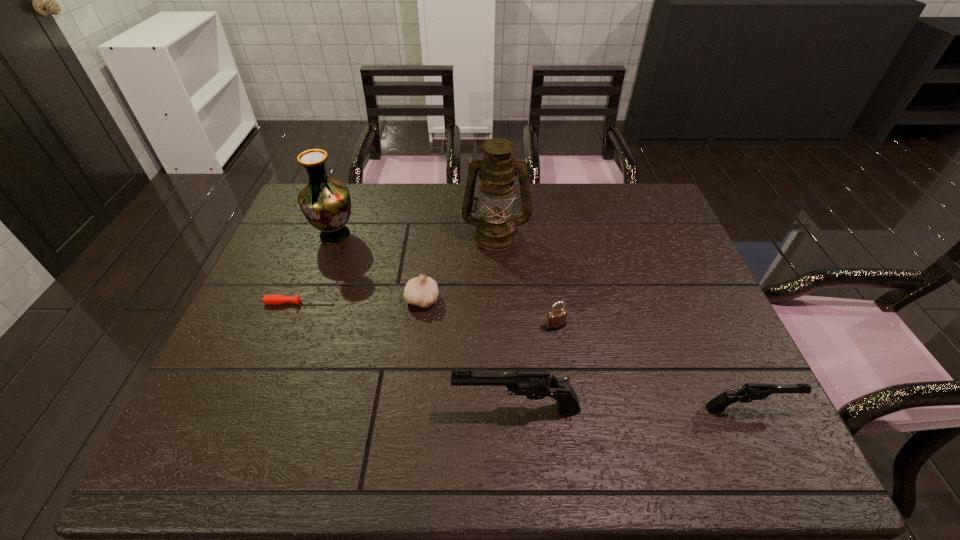
The height and width of the screenshot is (540, 960). Find the location of `vacant point located between the oil lamp and the fifth object from right to left`. vacant point located between the oil lamp and the fifth object from right to left is located at coordinates (459, 267).

Locate an element on the screen. free space between the shortest object and the second tallest object is located at coordinates (x=318, y=269).

The image size is (960, 540). What are the coordinates of `free space between the third object from left to right and the right gun` in the screenshot? It's located at (586, 354).

This screenshot has height=540, width=960. What are the coordinates of `unoccupied position between the sixth shortest object and the garlic` in the screenshot? It's located at (379, 267).

What are the coordinates of `empty space between the third nearest object and the left gun` in the screenshot? It's located at (536, 367).

This screenshot has width=960, height=540. I want to click on free space between the garlic and the shortest object, so click(x=361, y=301).

Locate an element on the screen. The height and width of the screenshot is (540, 960). free spot between the garlic and the screwdriver is located at coordinates (361, 301).

Where is `blank region between the screwdriver and the third object from left to right`? The image size is (960, 540). blank region between the screwdriver and the third object from left to right is located at coordinates (361, 301).

You are a GUI agent. You are given a task and a screenshot of the screen. Output one action in this format:
    pyautogui.click(x=<x>, y=<y>)
    Task: Click on the free space between the shorter gun and the sixth shortest object
    
    Given the screenshot: What is the action you would take?
    [x=541, y=322]

You are a GUI agent. You are given a task and a screenshot of the screen. Output one action in this format:
    pyautogui.click(x=<x>, y=<y>)
    Task: Click on the vacant region between the third nearest object and the shortest object
    
    Given the screenshot: What is the action you would take?
    pyautogui.click(x=427, y=314)